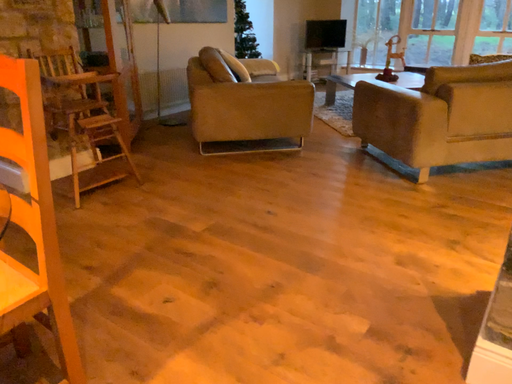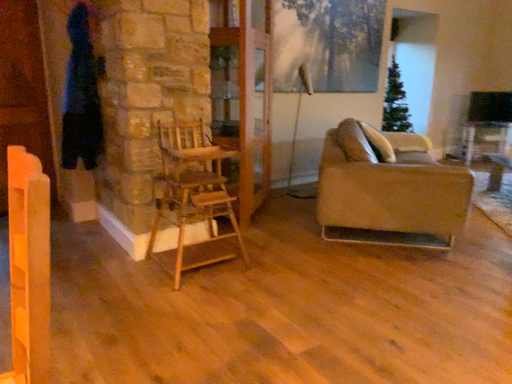
Question: Which way did the camera rotate in the video?

Choices:
 (A) rotated right
 (B) rotated left

Answer: (B)